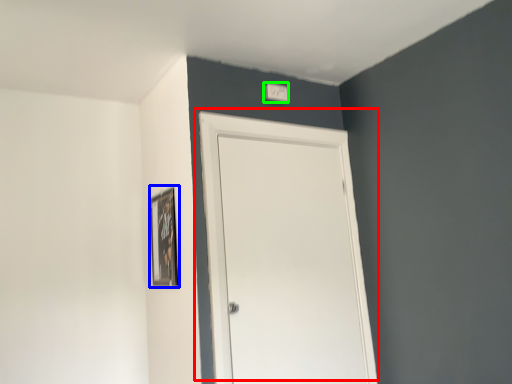
Question: Based on their relative distances, which object is nearer to door (highlighted by a red box)? Choose from picture frame (highlighted by a blue box) and light switch (highlighted by a green box).

Choices:
 (A) picture frame
 (B) light switch

Answer: (A)